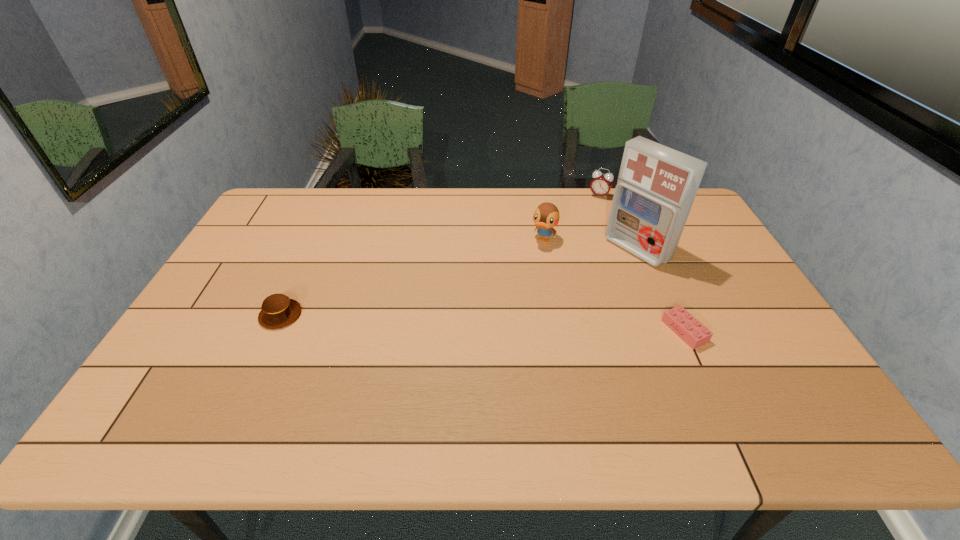
Find the location of `vacant space on the desktop that is between the muffin and the shortest object and is positioned on the clock face of the farthest object`. vacant space on the desktop that is between the muffin and the shortest object and is positioned on the clock face of the farthest object is located at coordinates (532, 325).

This screenshot has height=540, width=960. What are the coordinates of `free space on the desktop that is between the muffin and the shortest object and is positioned on the front-facing side of the second tallest object` in the screenshot? It's located at (496, 323).

Identify the location of vacant space on the desktop that is between the muffin and the shortest object and is positioned on the front-facing side of the first-aid kit. The width and height of the screenshot is (960, 540). (521, 325).